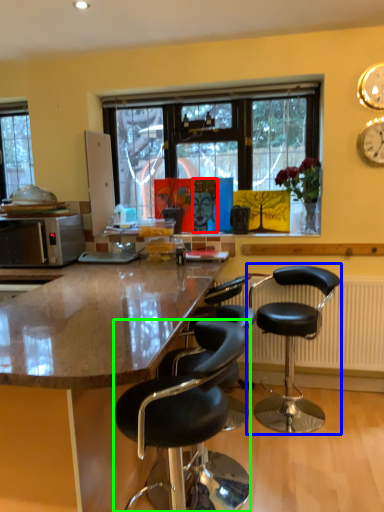
Question: Estimate the real-world distances between objects in this image. Which object is farther from person (highlighted by a red box), chair (highlighted by a blue box) or chair (highlighted by a green box)?

Choices:
 (A) chair
 (B) chair

Answer: (B)